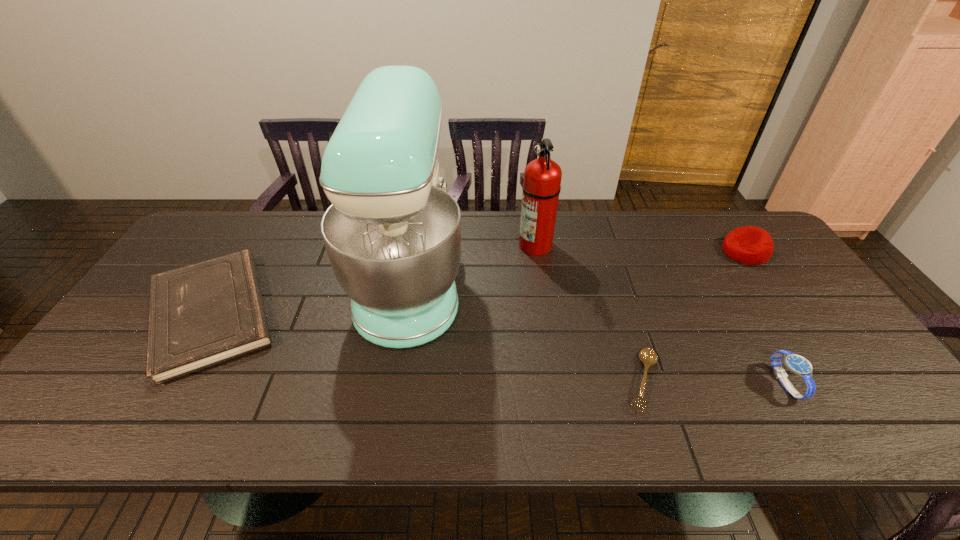
Identify the location of mixer that is at the far edge. This screenshot has width=960, height=540. (392, 234).

The image size is (960, 540). Identify the location of fire extinguisher at the far edge. 541,187.

Image resolution: width=960 pixels, height=540 pixels. In order to click on beanbag positioned at the far edge in this screenshot , I will do `click(750, 245)`.

This screenshot has width=960, height=540. In order to click on watch present at the near edge in this screenshot , I will do `click(797, 364)`.

Image resolution: width=960 pixels, height=540 pixels. What are the coordinates of `ladle that is at the near edge` in the screenshot? It's located at (648, 356).

Identify the location of object that is positioned at the left edge. The width and height of the screenshot is (960, 540). (206, 313).

This screenshot has height=540, width=960. I want to click on object that is at the right edge, so click(750, 245).

This screenshot has height=540, width=960. Find the location of `object at the far right corner`. object at the far right corner is located at coordinates (750, 245).

In the image, there is a desktop. Where is `vacant space at the far edge`? This screenshot has height=540, width=960. vacant space at the far edge is located at coordinates (315, 254).

Find the location of a particular element. free space at the near edge of the desktop is located at coordinates (380, 436).